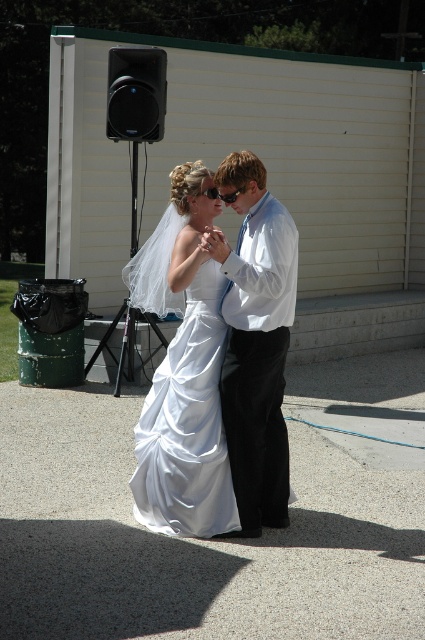
Question: Which of the following is the closest to the observer?

Choices:
 (A) satin white dress at center
 (B) white satin shirt at center

Answer: (B)

Question: Does white satin shirt at center lie in front of black plastic speaker at upper left?

Choices:
 (A) no
 (B) yes

Answer: (B)

Question: Where is white satin shirt at center located in relation to black plastic speaker at upper left in the image?

Choices:
 (A) right
 (B) left

Answer: (A)

Question: Which point appears farthest from the camera in this image?

Choices:
 (A) (124, 65)
 (B) (214, 476)

Answer: (A)

Question: Does white satin shirt at center appear over black plastic speaker at upper left?

Choices:
 (A) yes
 (B) no

Answer: (B)

Question: Which point appears closest to the camera in this image?

Choices:
 (A) pos(147,80)
 (B) pos(176,346)

Answer: (B)